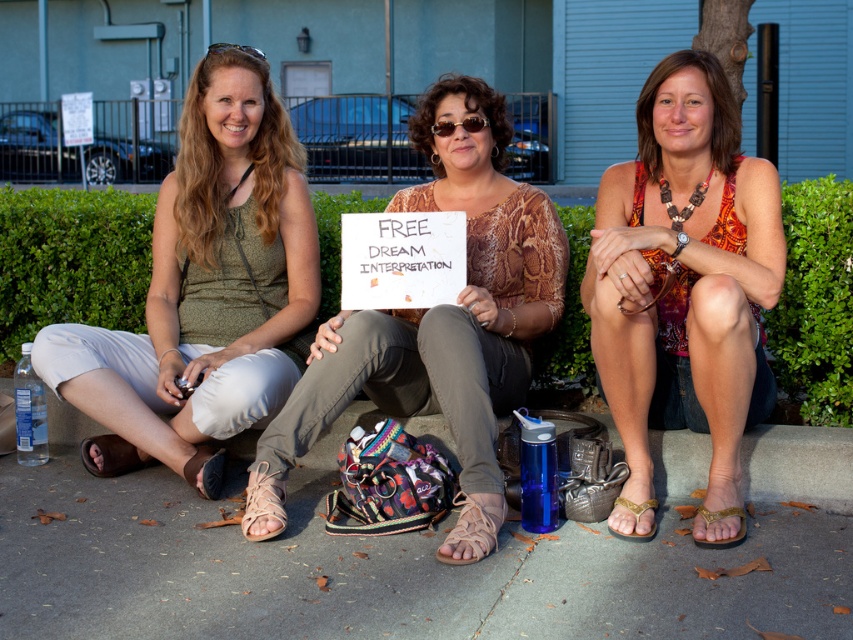
Is point (399, 621) more distant than point (625, 508)?

No, (399, 621) is closer to viewer.

Between point (796, 616) and point (611, 532), which one is positioned behind?

Positioned behind is point (611, 532).

Locate an element on the screen. The height and width of the screenshot is (640, 853). gray concrete pavement at lower center is located at coordinates (386, 568).

Who is more forward, (109,461) or (213,465)?

Point (213,465) is more forward.

Is brown leather sandal at lower left to the right of tan leather sandal at lower left from the viewer's perspective?

In fact, brown leather sandal at lower left is to the left of tan leather sandal at lower left.

Where is `brown leather sandal at lower left`? brown leather sandal at lower left is located at coordinates (112, 456).

I want to click on brown leather sandal at lower left, so click(x=112, y=456).

Between point (386, 369) and point (195, 467), which one is positioned behind?

The point (195, 467) is more distant.

Between brown snakeskin shirt at center and tan leather sandal at lower left, which one is positioned higher?

Positioned higher is brown snakeskin shirt at center.

Identify the location of brown snakeskin shirt at center. (445, 305).

Find the location of a particular element. This screenshot has width=853, height=640. brown snakeskin shirt at center is located at coordinates (445, 305).